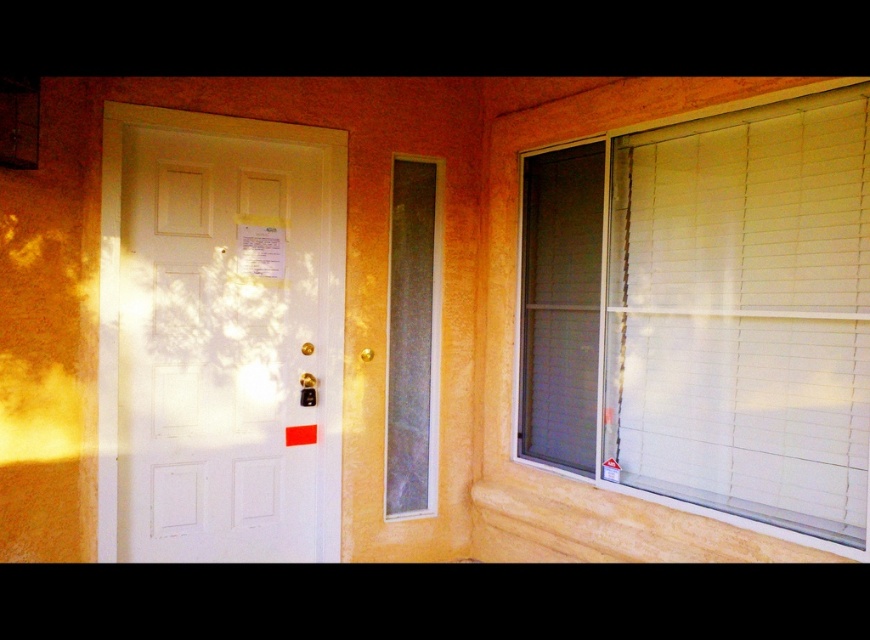
Question: Is white glossy screen door at left further to the viewer compared to clear glass window at center?

Choices:
 (A) no
 (B) yes

Answer: (A)

Question: Which of these objects is positioned farthest from the clear glass window at center?

Choices:
 (A) white glossy screen door at left
 (B) white matte blinds at right

Answer: (B)

Question: Which point is farther to the camera?

Choices:
 (A) (435, 176)
 (B) (838, 500)
 (C) (251, 365)

Answer: (A)

Question: In this image, where is white matte blinds at right located relative to clear glass window at center?

Choices:
 (A) below
 (B) above

Answer: (B)

Question: Which point is farther from the camera taking this photo?

Choices:
 (A) (403, 163)
 (B) (780, 252)

Answer: (A)

Question: Can you confirm if white matte blinds at right is wider than clear glass window at center?

Choices:
 (A) yes
 (B) no

Answer: (A)